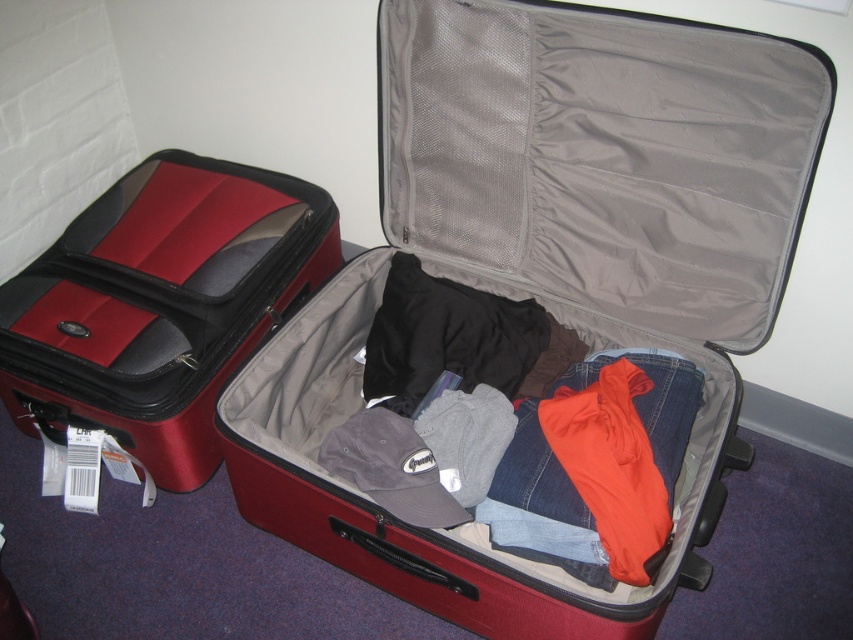
You are packing for a trip and need to know which suitcase has more space. Based on the image, which of the two suitcases, the matte red suitcase at center or the matte black suitcase at left, is likely wider?

The matte red suitcase at center might be wider than the matte black suitcase at left according to the description.

You are standing in front of two open red suitcases on a dark blue carpet. You need to place a 1.5 meter long item between the point at coordinate point (276, 196) and your current position. Will the item fit without bending?

The distance between point (276, 196) and the camera is 1.49 meters. Since the item is 1.5 meters long, it will not fit without bending.

Based on the photo, you are standing in front of two open red suitcases on a dark blue carpet. You need to place a small item exactly at the point marked as point (241, 476). Considering the distance between you and this point, can you safely reach it without stepping into the carpeted area?

The distance between point (241, 476) and the viewer is 1.24 meters. Since the point is within a reachable distance and not obstructed by the suitcases, you can safely place the item there without stepping onto the carpet.